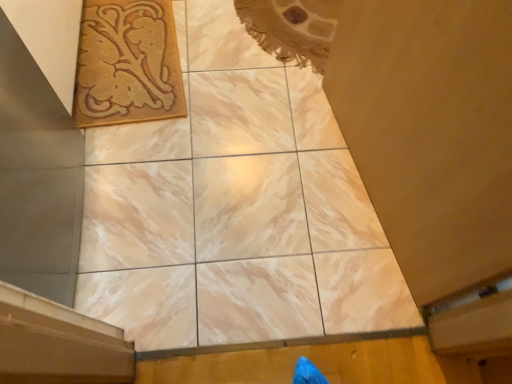
Question: Considering the relative sizes of wooden at lower right and beige woven rug at upper left in the image provided, is wooden at lower right bigger than beige woven rug at upper left?

Choices:
 (A) no
 (B) yes

Answer: (B)

Question: From the image's perspective, is wooden at lower right located above beige woven rug at upper left?

Choices:
 (A) no
 (B) yes

Answer: (A)

Question: Is wooden at lower right facing away from beige woven rug at upper left?

Choices:
 (A) yes
 (B) no

Answer: (B)

Question: Is wooden at lower right shorter than beige woven rug at upper left?

Choices:
 (A) yes
 (B) no

Answer: (B)

Question: Does wooden at lower right have a greater height compared to beige woven rug at upper left?

Choices:
 (A) no
 (B) yes

Answer: (B)

Question: Considering the positions of marble tile at center and beige woven rug at upper left in the image, is marble tile at center taller or shorter than beige woven rug at upper left?

Choices:
 (A) tall
 (B) short

Answer: (B)

Question: Is marble tile at center inside the boundaries of beige woven rug at upper left, or outside?

Choices:
 (A) outside
 (B) inside

Answer: (A)

Question: From a real-world perspective, is marble tile at center physically located above or below beige woven rug at upper left?

Choices:
 (A) above
 (B) below

Answer: (B)

Question: Considering the positions of marble tile at center and beige woven rug at upper left in the image, is marble tile at center bigger or smaller than beige woven rug at upper left?

Choices:
 (A) big
 (B) small

Answer: (B)

Question: Considering their positions, is marble tile at center located in front of or behind wooden at lower right?

Choices:
 (A) front
 (B) behind

Answer: (B)

Question: In terms of size, does marble tile at center appear bigger or smaller than wooden at lower right?

Choices:
 (A) small
 (B) big

Answer: (A)

Question: From the image's perspective, is marble tile at center located above or below wooden at lower right?

Choices:
 (A) below
 (B) above

Answer: (B)

Question: Is marble tile at center taller or shorter than wooden at lower right?

Choices:
 (A) short
 (B) tall

Answer: (A)

Question: Is wooden at lower right taller or shorter than beige woven rug at upper left?

Choices:
 (A) tall
 (B) short

Answer: (A)

Question: Looking at their shapes, would you say wooden at lower right is wider or thinner than beige woven rug at upper left?

Choices:
 (A) wide
 (B) thin

Answer: (B)